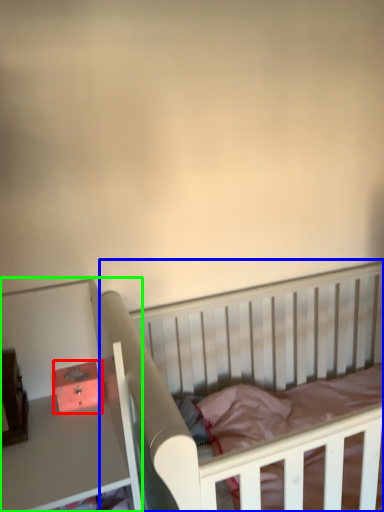
Question: Estimate the real-world distances between objects in this image. Which object is closer to box (highlighted by a red box), infant bed (highlighted by a blue box) or table (highlighted by a green box)?

Choices:
 (A) infant bed
 (B) table

Answer: (B)